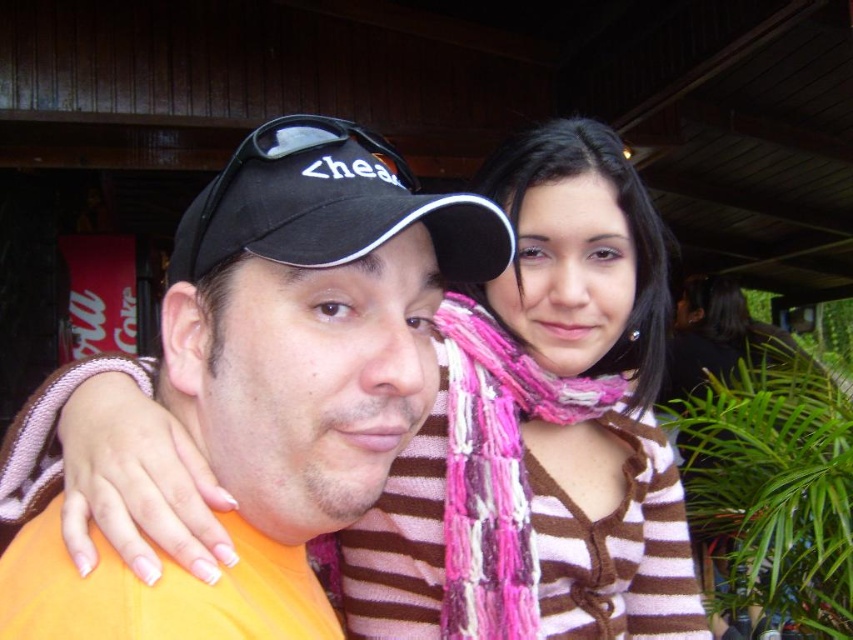
Question: Which point is farther to the camera?

Choices:
 (A) (393, 182)
 (B) (479, 472)
 (C) (239, 323)

Answer: (B)

Question: Which of these objects is positioned closest to the orange fabric shirt at center?

Choices:
 (A) pink yarn scarf at center
 (B) black fabric baseball cap at center

Answer: (B)

Question: Can you confirm if black fabric baseball cap at center is thinner than pink yarn scarf at center?

Choices:
 (A) yes
 (B) no

Answer: (B)

Question: Is orange fabric shirt at center bigger than black fabric baseball cap at center?

Choices:
 (A) no
 (B) yes

Answer: (B)

Question: Among these points, which one is nearest to the camera?

Choices:
 (A) (213, 211)
 (B) (372, 216)

Answer: (B)

Question: In this image, where is orange fabric shirt at center located relative to black fabric baseball cap at center?

Choices:
 (A) below
 (B) above

Answer: (A)